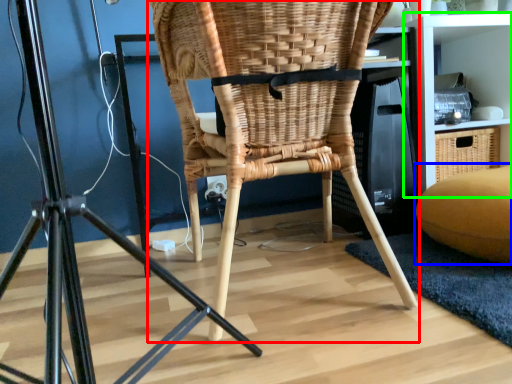
Question: Considering the real-world distances, which object is closest to chair (highlighted by a red box)? bean bag chair (highlighted by a blue box) or shelf (highlighted by a green box).

Choices:
 (A) bean bag chair
 (B) shelf

Answer: (A)